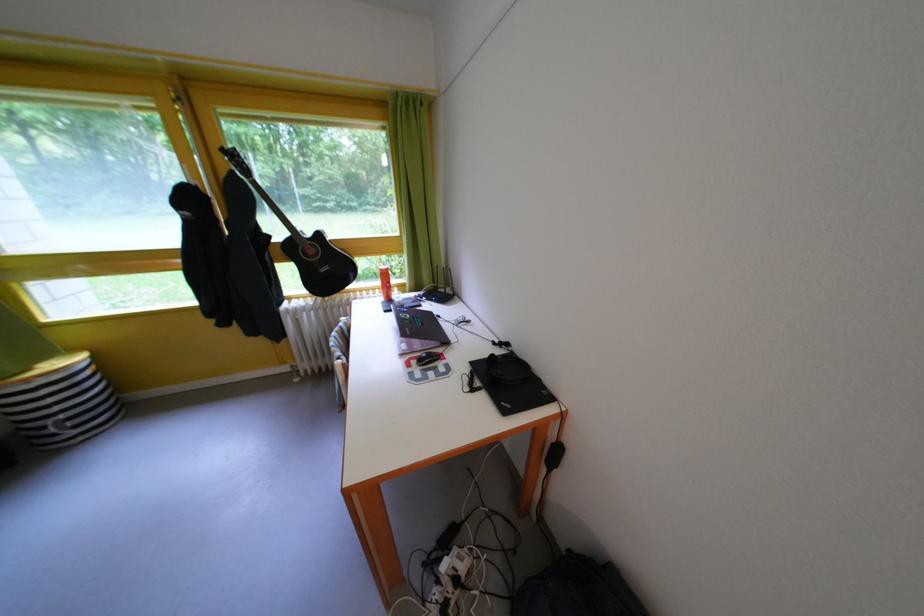
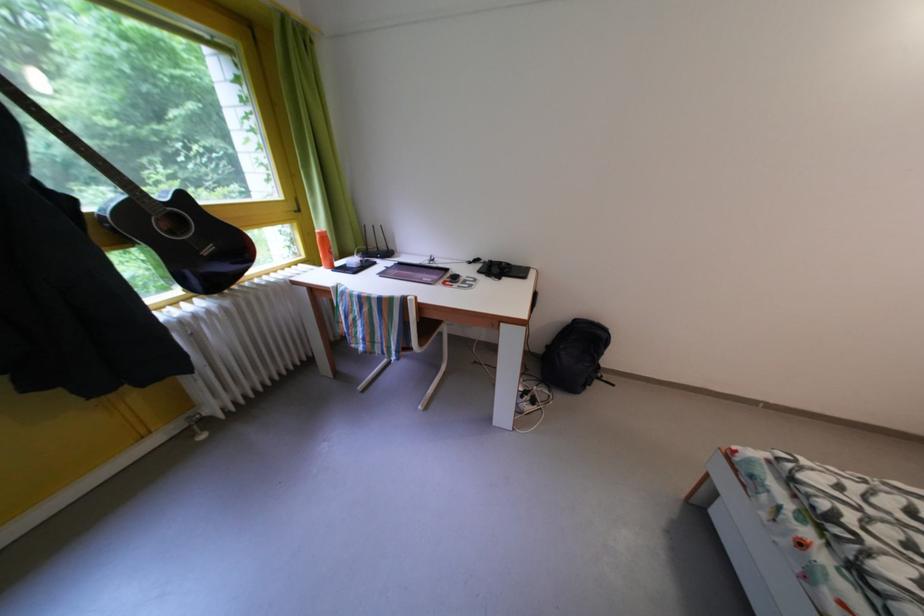
Find the pixel in the second image that matches [329,241] in the first image.

(191, 203)